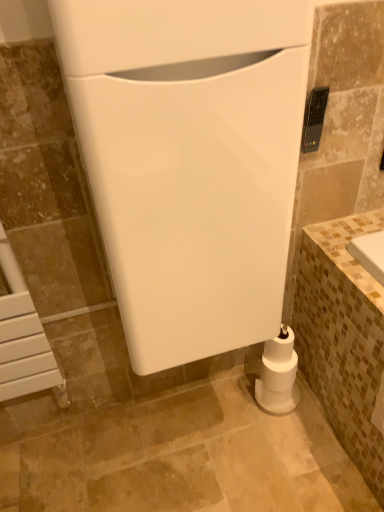
What do you see at coordinates (314, 119) in the screenshot?
I see `black plastic remote control at upper right, the first appliance when ordered from back to front` at bounding box center [314, 119].

Locate an element on the screen. The width and height of the screenshot is (384, 512). white matte toilet paper at lower right is located at coordinates (278, 374).

The image size is (384, 512). Describe the element at coordinates (278, 374) in the screenshot. I see `white matte toilet paper at lower right` at that location.

Identify the location of white glossy toilet at center, marked as the first appliance in a front-to-back arrangement. (190, 161).

Measure the distance between white matte toilet paper at lower right and black plastic remote control at upper right, the first appliance when ordered from back to front.

white matte toilet paper at lower right is 28.55 inches away from black plastic remote control at upper right, the first appliance when ordered from back to front.

Between white matte toilet paper at lower right and black plastic remote control at upper right, arranged as the second appliance when viewed from the front, which one appears on the left side from the viewer's perspective?

Positioned to the left is white matte toilet paper at lower right.

From a real-world perspective, is white matte toilet paper at lower right under black plastic remote control at upper right, arranged as the second appliance when viewed from the front?

Indeed, from a real-world perspective, white matte toilet paper at lower right is positioned beneath black plastic remote control at upper right, arranged as the second appliance when viewed from the front.

Could you tell me if white matte toilet paper at lower right is facing black plastic remote control at upper right, the first appliance when ordered from back to front?

No.

In the image, is white glossy toilet at center, marked as the first appliance in a front-to-back arrangement, on the left side or the right side of white matte toilet paper at lower right?

Based on their positions, white glossy toilet at center, marked as the first appliance in a front-to-back arrangement, is located to the left of white matte toilet paper at lower right.

Which is in front, point (211, 167) or point (284, 354)?

The point (211, 167) is closer.

From a real-world perspective, which object stands above the other?

white glossy toilet at center, the 2th appliance in the right-to-left sequence, from a real-world perspective.

The height and width of the screenshot is (512, 384). Identify the location of appliance that is on the left side of white matte toilet paper at lower right. (190, 161).

Does point (320, 108) come closer to viewer compared to point (159, 98)?

No, (320, 108) is behind (159, 98).

Based on the photo, from a real-world perspective, who is located higher, black plastic remote control at upper right, arranged as the second appliance when viewed from the front, or white glossy toilet at center, which is the second appliance in back-to-front order?

From a 3D spatial view, black plastic remote control at upper right, arranged as the second appliance when viewed from the front, is above.

Can white glossy toilet at center, which is the second appliance in back-to-front order, be found inside black plastic remote control at upper right, arranged as the first appliance when viewed from the right?

No.

Locate an element on the screen. appliance below the black plastic remote control at upper right, arranged as the second appliance when viewed from the front (from the image's perspective) is located at coordinates (190, 161).

Does black plastic remote control at upper right, arranged as the second appliance when viewed from the front, have a lesser width compared to white matte toilet paper at lower right?

Correct, the width of black plastic remote control at upper right, arranged as the second appliance when viewed from the front, is less than that of white matte toilet paper at lower right.

Between point (319, 121) and point (290, 328), which one is positioned in front?

The point (319, 121) is closer to the camera.

Is black plastic remote control at upper right, the second appliance positioned from the left, facing away from white matte toilet paper at lower right?

No, black plastic remote control at upper right, the second appliance positioned from the left, is not facing the opposite direction of white matte toilet paper at lower right.

Can you see black plastic remote control at upper right, the second appliance positioned from the left, touching white matte toilet paper at lower right?

No, black plastic remote control at upper right, the second appliance positioned from the left, is not making contact with white matte toilet paper at lower right.

Considering the positions of objects white glossy toilet at center, which is the first appliance in left-to-right order, and black plastic remote control at upper right, the second appliance positioned from the left, in the image provided, who is in front, white glossy toilet at center, which is the first appliance in left-to-right order, or black plastic remote control at upper right, the second appliance positioned from the left,?

white glossy toilet at center, which is the first appliance in left-to-right order, is in front.

Is white glossy toilet at center, which is the second appliance in back-to-front order, thinner than black plastic remote control at upper right, arranged as the second appliance when viewed from the front?

Incorrect, the width of white glossy toilet at center, which is the second appliance in back-to-front order, is not less than that of black plastic remote control at upper right, arranged as the second appliance when viewed from the front.

From the image's perspective, relative to black plastic remote control at upper right, the second appliance positioned from the left, is white glossy toilet at center, marked as the first appliance in a front-to-back arrangement, above or below?

white glossy toilet at center, marked as the first appliance in a front-to-back arrangement, is situated lower than black plastic remote control at upper right, the second appliance positioned from the left, in the image.

This screenshot has height=512, width=384. Identify the location of appliance lying on the right of white glossy toilet at center, which is the second appliance in back-to-front order. (314, 119).

Can you confirm if white matte toilet paper at lower right is bigger than white glossy toilet at center, which is the first appliance in left-to-right order?

Incorrect, white matte toilet paper at lower right is not larger than white glossy toilet at center, which is the first appliance in left-to-right order.

In the image, is white matte toilet paper at lower right on the left side or the right side of white glossy toilet at center, marked as the first appliance in a front-to-back arrangement?

white matte toilet paper at lower right is to the right of white glossy toilet at center, marked as the first appliance in a front-to-back arrangement.

The image size is (384, 512). In order to click on toilet paper below the white glossy toilet at center, marked as the first appliance in a front-to-back arrangement (from a real-world perspective) in this screenshot , I will do `click(278, 374)`.

The image size is (384, 512). I want to click on toilet paper that is below the black plastic remote control at upper right, arranged as the first appliance when viewed from the right (from the image's perspective), so click(x=278, y=374).

Identify the location of appliance that is the 1st object above the white matte toilet paper at lower right (from a real-world perspective). This screenshot has width=384, height=512. (190, 161).

Which object lies further to the anchor point black plastic remote control at upper right, the first appliance when ordered from back to front, white glossy toilet at center, marked as the first appliance in a front-to-back arrangement, or white matte toilet paper at lower right?

Based on the image, white matte toilet paper at lower right appears to be further to black plastic remote control at upper right, the first appliance when ordered from back to front.

Estimate the real-world distances between objects in this image. Which object is closer to white glossy toilet at center, marked as the first appliance in a front-to-back arrangement, white matte toilet paper at lower right or black plastic remote control at upper right, arranged as the first appliance when viewed from the right?

Based on the image, black plastic remote control at upper right, arranged as the first appliance when viewed from the right, appears to be nearer to white glossy toilet at center, marked as the first appliance in a front-to-back arrangement.

Considering their positions, is black plastic remote control at upper right, arranged as the first appliance when viewed from the right, positioned further to white glossy toilet at center, marked as the first appliance in a front-to-back arrangement, than white matte toilet paper at lower right?

white matte toilet paper at lower right lies further to white glossy toilet at center, marked as the first appliance in a front-to-back arrangement, than the other object.

Looking at the image, which one is located closer to black plastic remote control at upper right, arranged as the second appliance when viewed from the front, white matte toilet paper at lower right or white glossy toilet at center, marked as the first appliance in a front-to-back arrangement?

white glossy toilet at center, marked as the first appliance in a front-to-back arrangement, is positioned closer to the anchor black plastic remote control at upper right, arranged as the second appliance when viewed from the front.

From the image, which object appears to be nearer to white matte toilet paper at lower right, white glossy toilet at center, the 2th appliance in the right-to-left sequence, or black plastic remote control at upper right, arranged as the first appliance when viewed from the right?

white glossy toilet at center, the 2th appliance in the right-to-left sequence, lies closer to white matte toilet paper at lower right than the other object.

Based on their spatial positions, is black plastic remote control at upper right, the second appliance positioned from the left, or white glossy toilet at center, which is the second appliance in back-to-front order, closer to white matte toilet paper at lower right?

Based on the image, white glossy toilet at center, which is the second appliance in back-to-front order, appears to be nearer to white matte toilet paper at lower right.

The image size is (384, 512). I want to click on appliance between black plastic remote control at upper right, arranged as the first appliance when viewed from the right, and white matte toilet paper at lower right in the up-down direction, so click(x=190, y=161).